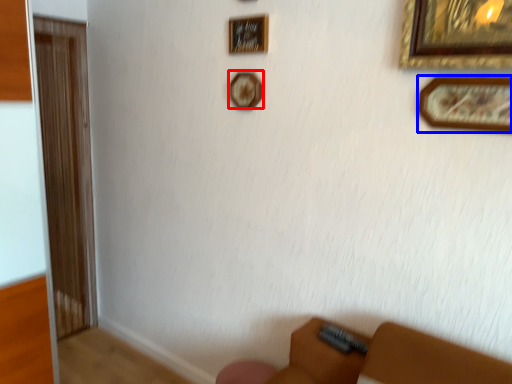
Question: Which point is closer to the camera, picture frame (highlighted by a red box) or picture frame (highlighted by a blue box)?

Choices:
 (A) picture frame
 (B) picture frame

Answer: (B)